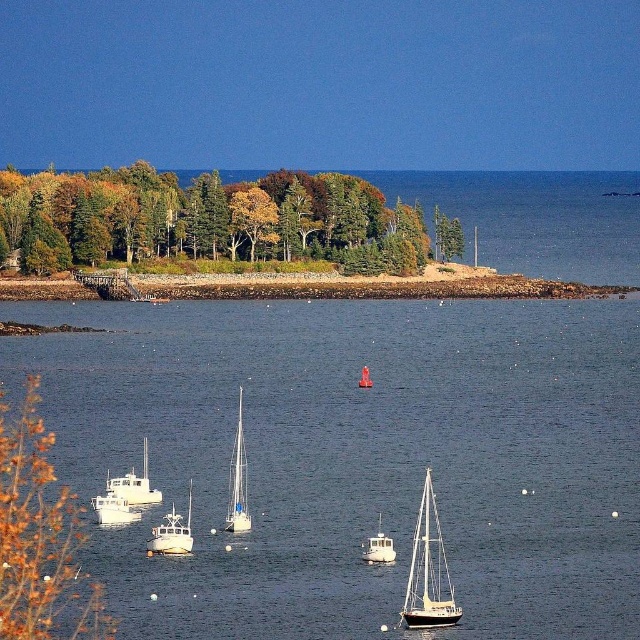
Question: Which point is closer to the camera taking this photo?

Choices:
 (A) (97, 296)
 (B) (33, 480)

Answer: (B)

Question: Among these objects, which one is nearest to the camera?

Choices:
 (A) white matte boat at lower center
 (B) white matte boat at lower left
 (C) white matte sailboat at lower left

Answer: (A)

Question: Which object appears farthest from the camera in this image?

Choices:
 (A) smooth stone pier at center
 (B) white glossy sailboat at lower center
 (C) green leafy trees at upper left
 (D) white matte boat at lower left

Answer: (A)

Question: Is white glossy sailboat at center positioned at the back of white matte boat at center?

Choices:
 (A) yes
 (B) no

Answer: (A)

Question: Does white glossy sailboat at lower center appear on the left side of white matte boat at lower center?

Choices:
 (A) yes
 (B) no

Answer: (B)

Question: Does smooth stone pier at center have a lesser width compared to white matte sailboat at lower left?

Choices:
 (A) no
 (B) yes

Answer: (A)